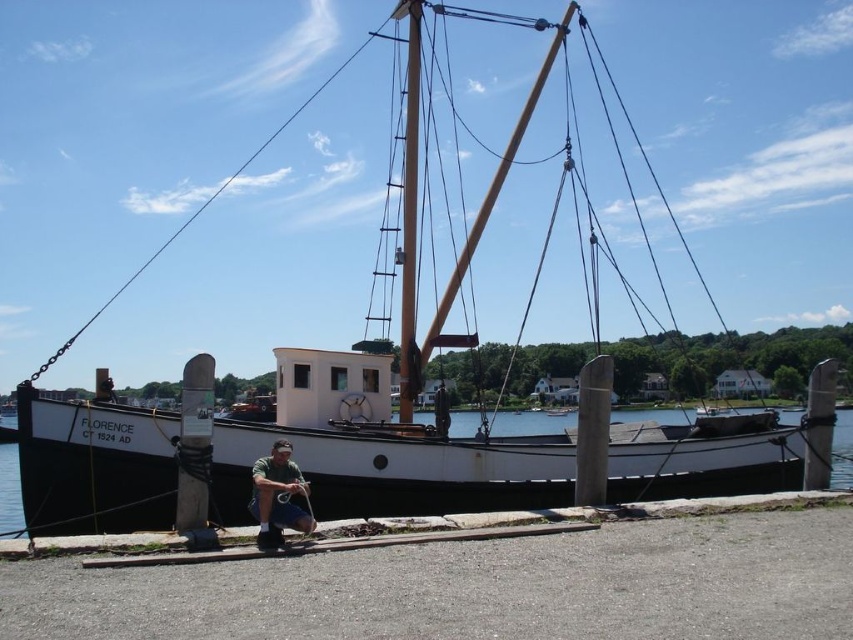
Is point (410, 317) farther from camera compared to point (293, 528)?

Yes.

Does wooden mast at center have a greater height compared to green matte shirt at lower center?

Indeed, wooden mast at center has a greater height compared to green matte shirt at lower center.

Between point (410, 68) and point (264, 467), which one is positioned in front?

Point (264, 467) is in front.

Image resolution: width=853 pixels, height=640 pixels. What are the coordinates of `wooden mast at center` in the screenshot? It's located at (409, 216).

Between wooden mast at center and white matte water at center, which one is positioned lower?

white matte water at center

Is point (408, 54) in front of point (9, 420)?

That is True.

Describe the element at coordinates (409, 216) in the screenshot. This screenshot has width=853, height=640. I see `wooden mast at center` at that location.

At what (x,y) coordinates should I click in order to perform the action: click on wooden mast at center. Please return your answer as a coordinate pair (x, y). Looking at the image, I should click on (409, 216).

How much distance is there between white matte water at center and green matte shirt at lower center?

A distance of 19.35 meters exists between white matte water at center and green matte shirt at lower center.

Does point (9, 532) come closer to viewer compared to point (283, 440)?

No, it is not.

Who is more forward, (618, 412) or (273, 522)?

Point (273, 522) is more forward.

In order to click on white matte water at center in this screenshot , I will do `click(9, 490)`.